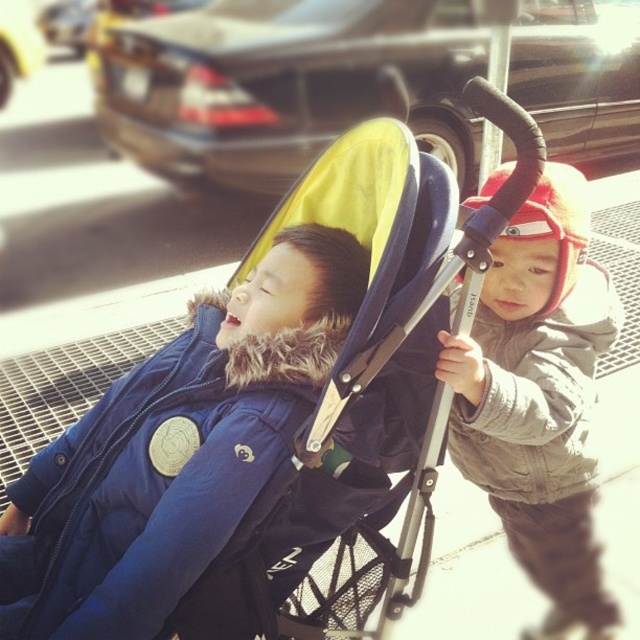
Question: In this image, where is yellow fabric baby carriage at center located relative to blue down jacket at left?

Choices:
 (A) above
 (B) below

Answer: (A)

Question: Which object is the farthest from the blue down jacket at left?

Choices:
 (A) gray fleece jacket at upper right
 (B) gray fleece jacket at right

Answer: (B)

Question: Is yellow fabric baby carriage at center to the right of gray fleece jacket at upper right from the viewer's perspective?

Choices:
 (A) yes
 (B) no

Answer: (B)

Question: Is yellow fabric baby carriage at center above gray fleece jacket at upper right?

Choices:
 (A) yes
 (B) no

Answer: (B)

Question: Which object appears closest to the camera in this image?

Choices:
 (A) gray fleece jacket at upper right
 (B) yellow fabric baby carriage at center

Answer: (B)

Question: Estimate the real-world distances between objects in this image. Which object is farther from the gray fleece jacket at upper right?

Choices:
 (A) gray fleece jacket at right
 (B) yellow fabric baby carriage at center
 (C) blue down jacket at left

Answer: (C)